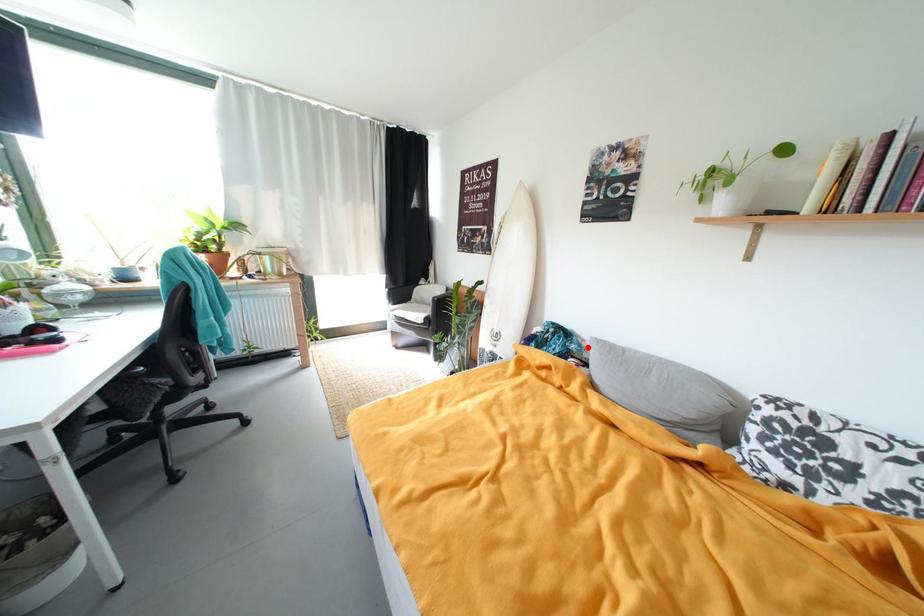
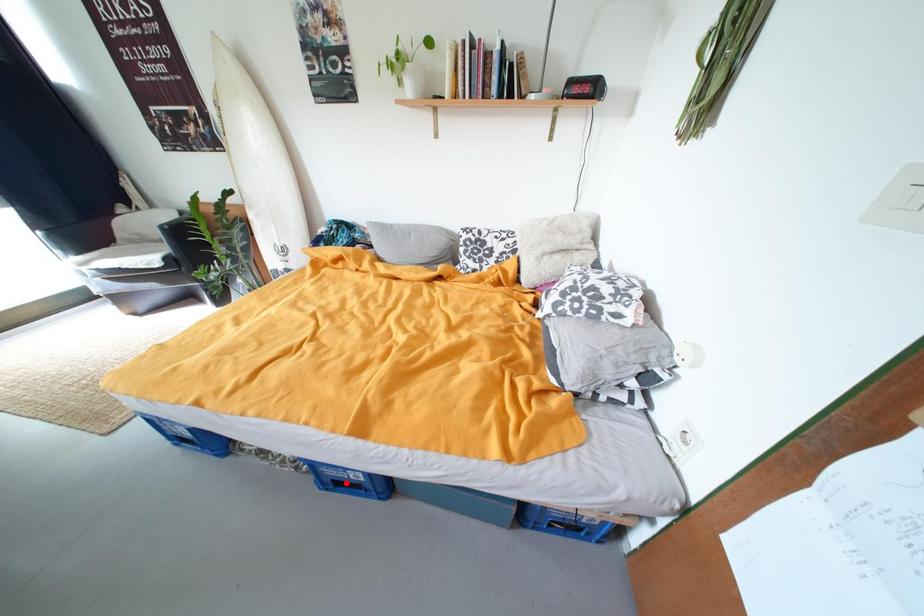
I am providing you with two images of the same scene from different viewpoints. A red point is marked on the first image and another point is marked on the second image. Do the highlighted points in image1 and image2 indicate the same real-world spot?

No